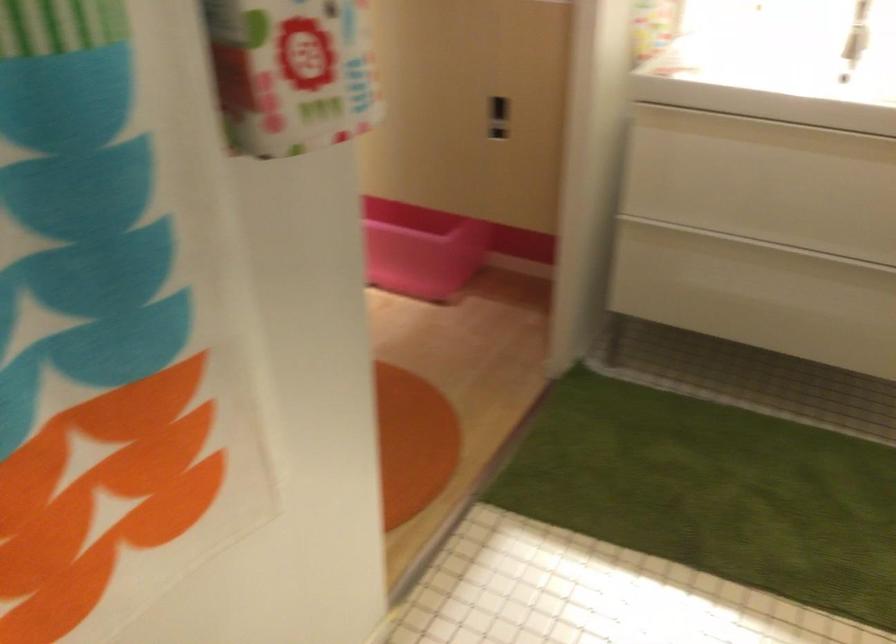
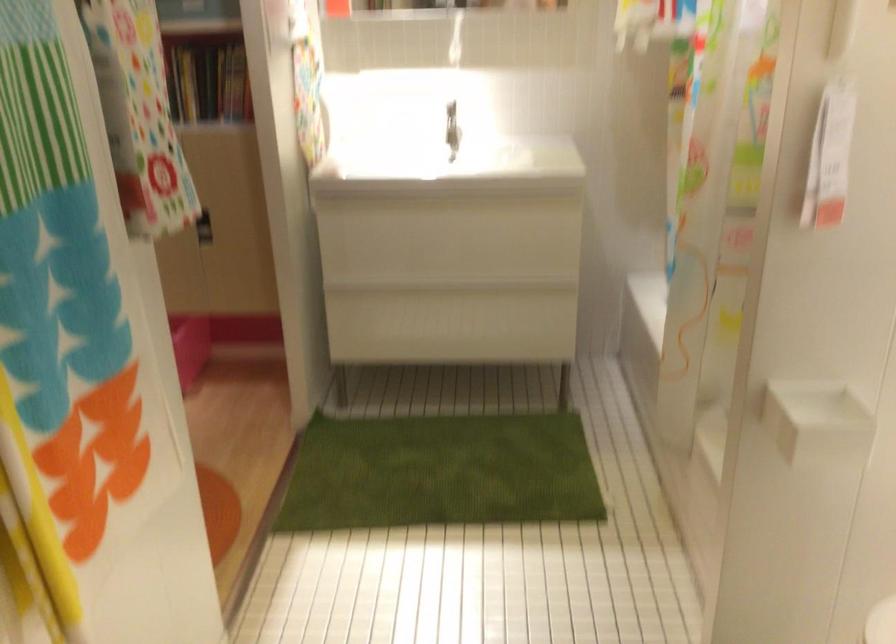
Where in the second image is the point corresponding to point 802,249 from the first image?

(453, 288)